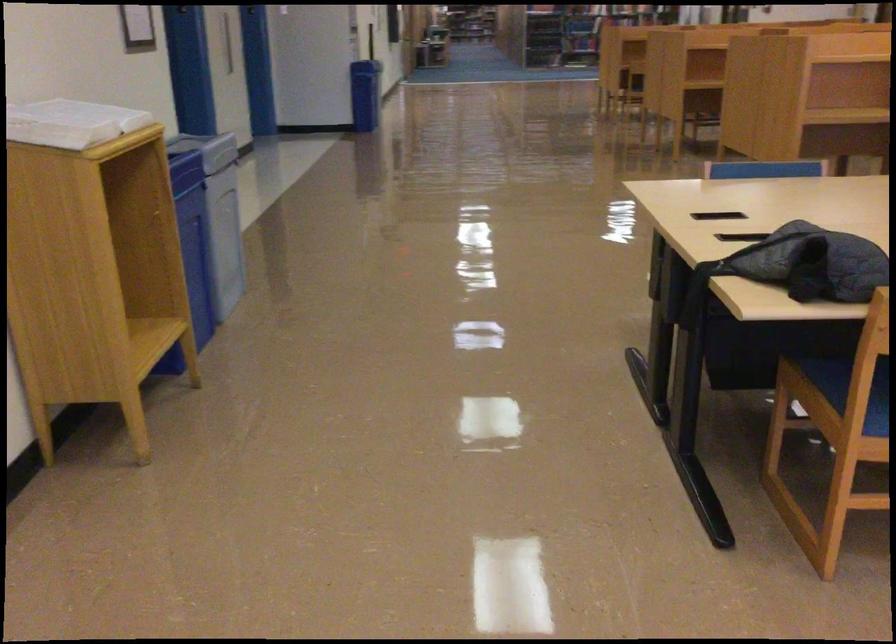
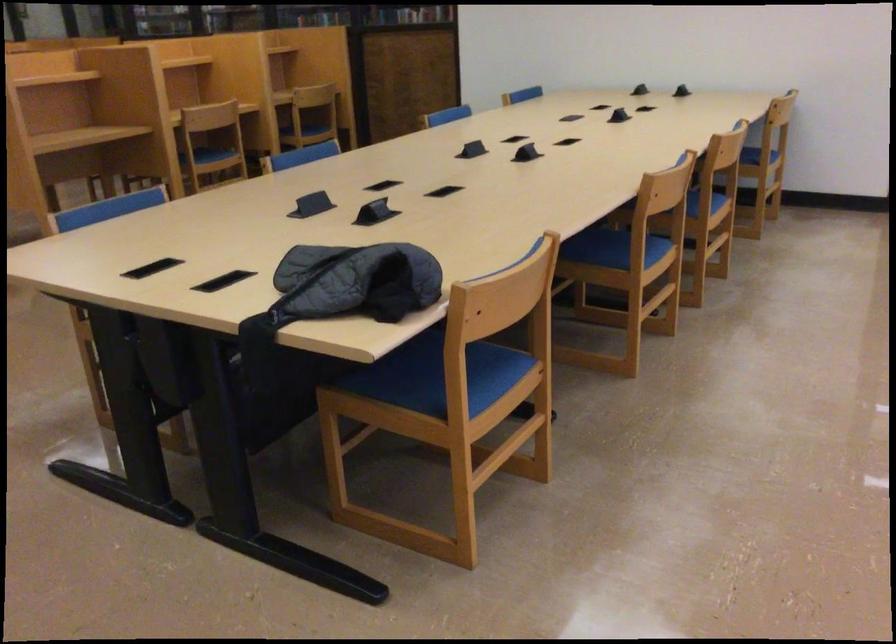
Question: The first image is from the beginning of the video and the second image is from the end. How did the camera likely rotate when shooting the video?

Choices:
 (A) Left
 (B) Right
 (C) Up
 (D) Down

Answer: (B)